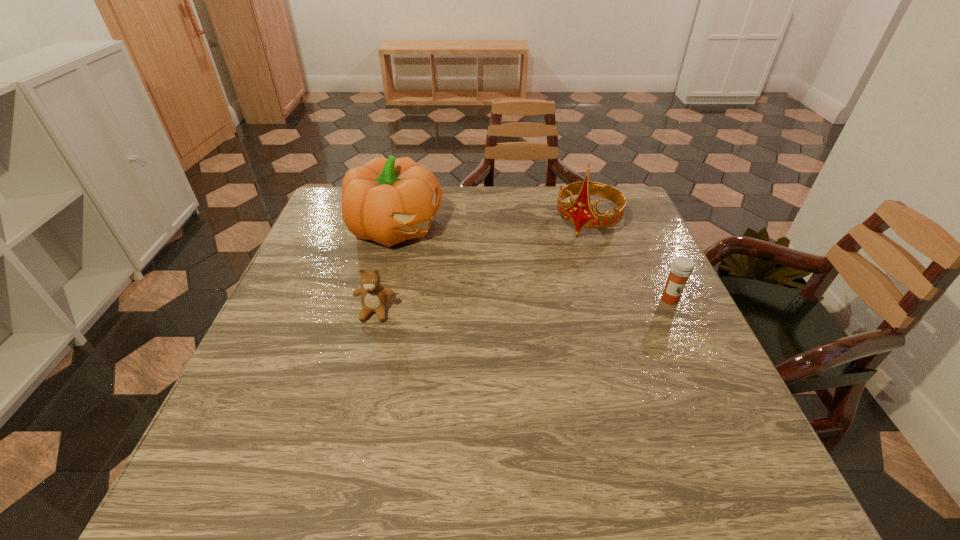
In the image, there is a desktop. At what (x,y) coordinates should I click in order to perform the action: click on vacant space at the near edge. Please return your answer as a coordinate pair (x, y). The image size is (960, 540). Looking at the image, I should click on (624, 434).

In order to click on free space at the left edge in this screenshot , I will do `click(296, 322)`.

In the image, there is a desktop. Identify the location of free space at the right edge. The width and height of the screenshot is (960, 540). (653, 244).

The image size is (960, 540). I want to click on vacant region at the near right corner of the desktop, so pos(680,416).

This screenshot has width=960, height=540. I want to click on free space between the rightmost object and the teddy bear, so coord(522,306).

I want to click on vacant space that is in between the second object from right to left and the medicine, so click(628, 261).

Find the location of a particular element. The width and height of the screenshot is (960, 540). free space that is in between the tiara and the teddy bear is located at coordinates (481, 267).

The image size is (960, 540). I want to click on free space between the pumpkin and the rightmost object, so click(532, 264).

The image size is (960, 540). What are the coordinates of `vacant point located between the pumpkin and the tiara` in the screenshot? It's located at (491, 225).

Image resolution: width=960 pixels, height=540 pixels. I want to click on empty location between the pumpkin and the third object from left to right, so click(491, 225).